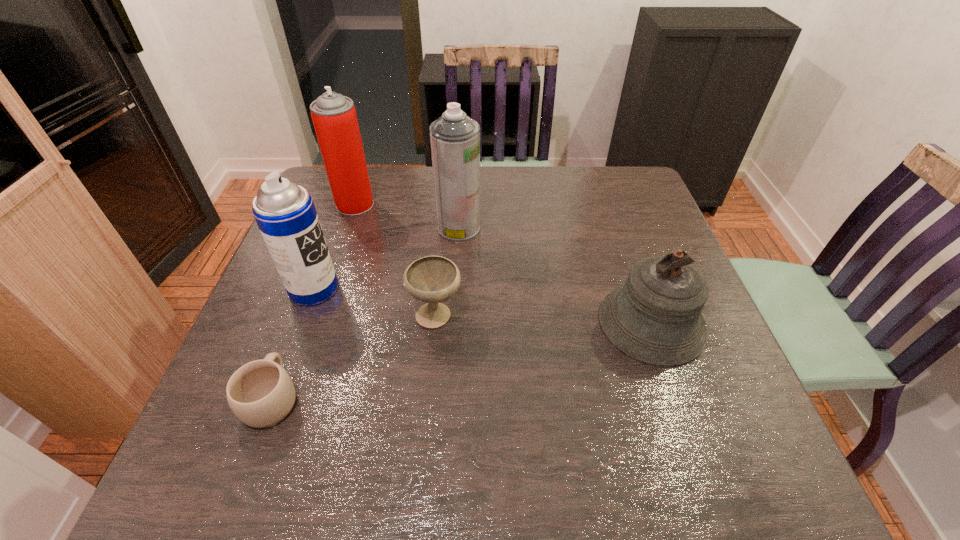
Locate an element on the screen. The height and width of the screenshot is (540, 960). free space at the left edge of the desktop is located at coordinates (341, 226).

In the image, there is a desktop. Identify the location of vacant space at the right edge. (617, 219).

The height and width of the screenshot is (540, 960). In order to click on blank region between the nearest aerosol can and the mug in this screenshot , I will do `click(293, 343)`.

Where is `empty space between the shortest object and the chalice`? The image size is (960, 540). empty space between the shortest object and the chalice is located at coordinates (354, 356).

In order to click on vacant area that lies between the bell and the shortest object in this screenshot , I will do `click(462, 360)`.

Find the location of a particular element. The width and height of the screenshot is (960, 540). object that stands as the closest to the second shortest object is located at coordinates (285, 213).

Locate an element on the screen. This screenshot has width=960, height=540. object identified as the second closest to the nearest aerosol can is located at coordinates (432, 279).

Identify which aerosol can is located as the nearest to the rightmost object. Please provide its 2D coordinates. Your answer should be formatted as a tuple, i.e. [(x, y)], where the tuple contains the x and y coordinates of a point satisfying the conditions above.

[(455, 138)]

Where is `aerosol can that is the closest to the nearest object`? Image resolution: width=960 pixels, height=540 pixels. aerosol can that is the closest to the nearest object is located at coordinates (285, 213).

You are a GUI agent. You are given a task and a screenshot of the screen. Output one action in this format:
    pyautogui.click(x=<x>, y=<y>)
    Task: Click on the free space that satisfies the following two spatial constraints: 1. on the back side of the rightmost aerosol can; 2. on the right side of the chalice
    The image size is (960, 540).
    Given the screenshot: What is the action you would take?
    pyautogui.click(x=444, y=227)